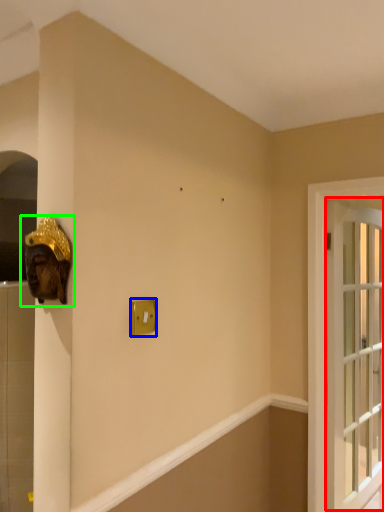
Question: Based on their relative distances, which object is farther from window (highlighted by a red box)? Choose from light switch (highlighted by a blue box) and sculpture (highlighted by a green box).

Choices:
 (A) light switch
 (B) sculpture

Answer: (B)